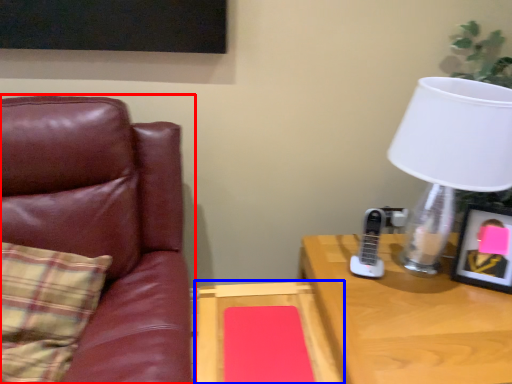
Question: Among these objects, which one is farthest to the camera, chair (highlighted by a red box) or table (highlighted by a blue box)?

Choices:
 (A) chair
 (B) table

Answer: (B)